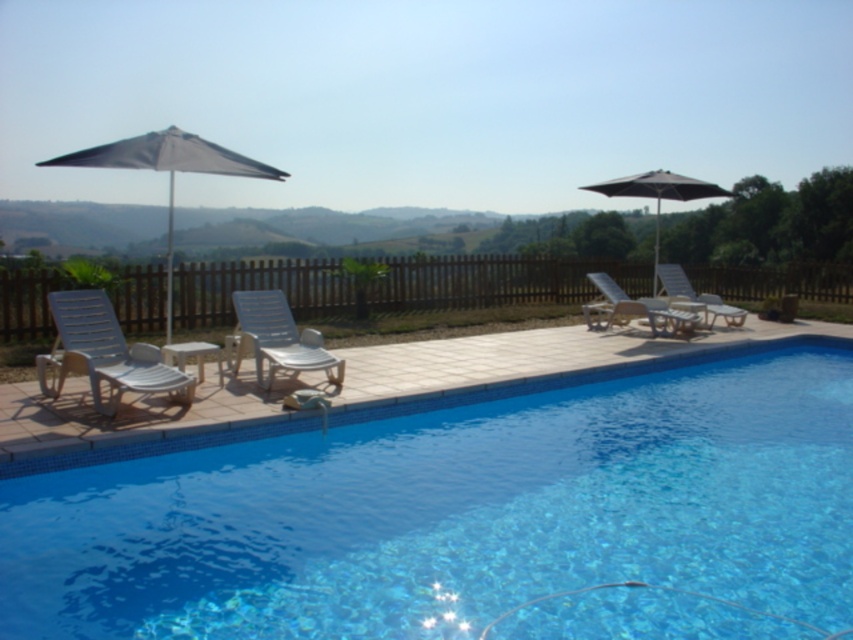
Who is positioned more to the right, dark gray fabric umbrella at left or matte black umbrella at upper right?

matte black umbrella at upper right

Between dark gray fabric umbrella at left and matte black umbrella at upper right, which one has more height?

dark gray fabric umbrella at left is taller.

What do you see at coordinates (167, 170) in the screenshot? This screenshot has height=640, width=853. I see `dark gray fabric umbrella at left` at bounding box center [167, 170].

The width and height of the screenshot is (853, 640). What are the coordinates of `dark gray fabric umbrella at left` in the screenshot? It's located at (167, 170).

Does dark gray fabric umbrella at left come in front of white plastic chair at center?

Yes, it is.

Can you confirm if dark gray fabric umbrella at left is wider than white plastic chair at center?

Yes, dark gray fabric umbrella at left is wider than white plastic chair at center.

Is point (152, 131) positioned behind point (271, 378)?

Yes, it is behind point (271, 378).

Identify the location of dark gray fabric umbrella at left. (167, 170).

Can you confirm if white plastic lounge chair at left is smaller than metallic silver lounge chair at right?

Yes.

Measure the distance from white plastic lounge chair at left to metallic silver lounge chair at right.

A distance of 7.37 meters exists between white plastic lounge chair at left and metallic silver lounge chair at right.

This screenshot has height=640, width=853. What do you see at coordinates (105, 353) in the screenshot?
I see `white plastic lounge chair at left` at bounding box center [105, 353].

This screenshot has height=640, width=853. Identify the location of white plastic lounge chair at left. (105, 353).